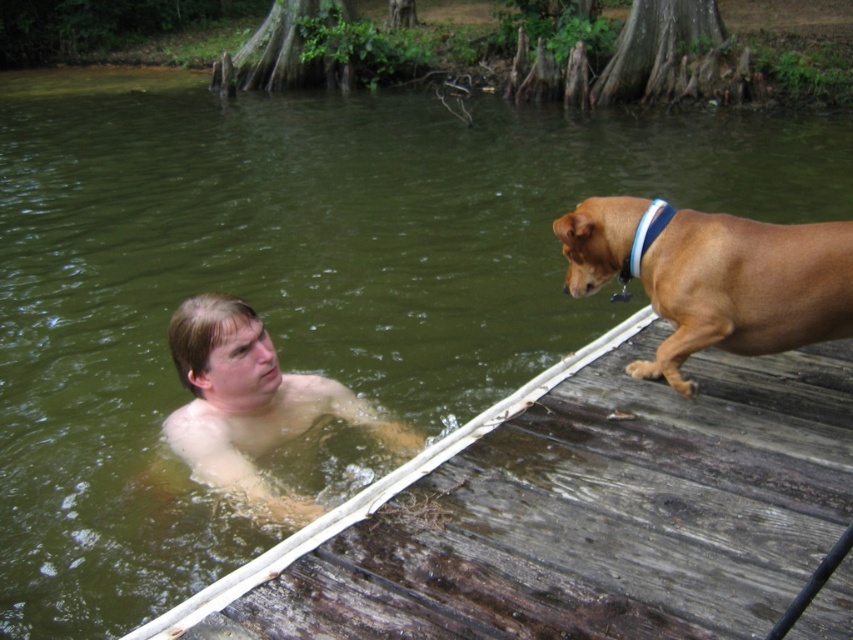
Does weathered wood dock at lower right have a lesser width compared to pale skin/soft flesh man at upper center?

No, weathered wood dock at lower right is not thinner than pale skin/soft flesh man at upper center.

Who is positioned more to the left, weathered wood dock at lower right or pale skin/soft flesh man at upper center?

pale skin/soft flesh man at upper center

This screenshot has height=640, width=853. What do you see at coordinates (573, 513) in the screenshot? I see `weathered wood dock at lower right` at bounding box center [573, 513].

Find the location of a particular element. This screenshot has width=853, height=640. weathered wood dock at lower right is located at coordinates (573, 513).

Is weathered wood dock at lower right to the left of brown smooth dog at right from the viewer's perspective?

Yes, weathered wood dock at lower right is to the left of brown smooth dog at right.

Can you confirm if weathered wood dock at lower right is smaller than brown smooth dog at right?

Incorrect, weathered wood dock at lower right is not smaller in size than brown smooth dog at right.

Who is more forward, [483,616] or [763,304]?

Point [483,616] is more forward.

I want to click on weathered wood dock at lower right, so click(573, 513).

Who is lower down, brown smooth dog at right or pale skin/soft flesh man at upper center?

pale skin/soft flesh man at upper center is below.

Is point (755, 333) farther from camera compared to point (329, 406)?

No, (755, 333) is closer to viewer.

Which is behind, point (815, 252) or point (282, 515)?

Point (282, 515)

Find the location of a particular element. brown smooth dog at right is located at coordinates (744, 288).